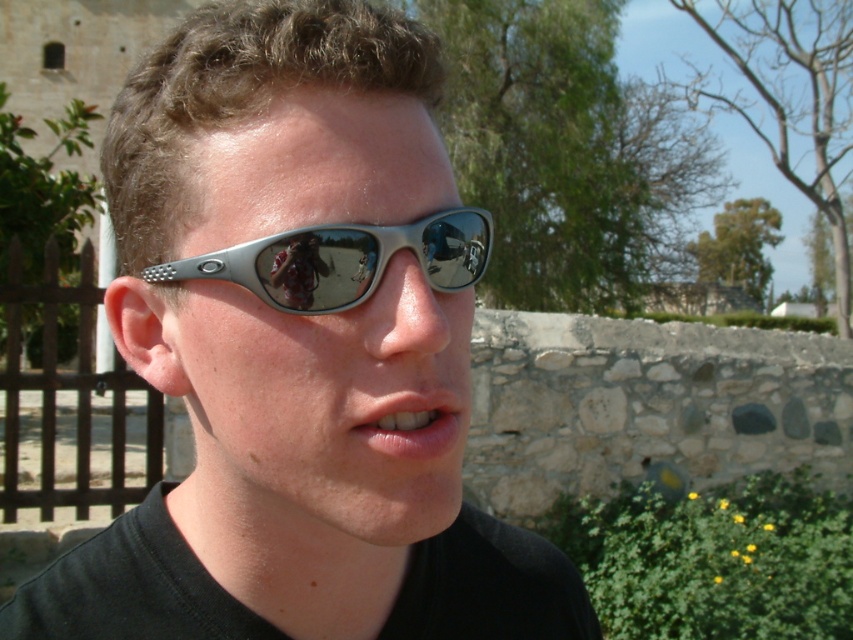
Can you confirm if metallic silver sunglasses at center is positioned below silver metallic sunglasses at center?

Yes, metallic silver sunglasses at center is below silver metallic sunglasses at center.

Locate an element on the screen. metallic silver sunglasses at center is located at coordinates (294, 348).

I want to click on metallic silver sunglasses at center, so click(x=294, y=348).

Between metallic silver sunglasses at center and smooth matte lips at center, which one appears on the left side from the viewer's perspective?

metallic silver sunglasses at center is more to the left.

Does metallic silver sunglasses at center appear on the left side of smooth matte lips at center?

Indeed, metallic silver sunglasses at center is positioned on the left side of smooth matte lips at center.

The height and width of the screenshot is (640, 853). What do you see at coordinates (294, 348) in the screenshot?
I see `metallic silver sunglasses at center` at bounding box center [294, 348].

In order to click on metallic silver sunglasses at center in this screenshot , I will do pyautogui.click(x=294, y=348).

Does silver metallic sunglasses at center have a smaller size compared to smooth matte lips at center?

No, silver metallic sunglasses at center is not smaller than smooth matte lips at center.

Who is more forward, (331, 296) or (364, 394)?

Point (331, 296) is more forward.

Locate an element on the screen. This screenshot has height=640, width=853. silver metallic sunglasses at center is located at coordinates (343, 260).